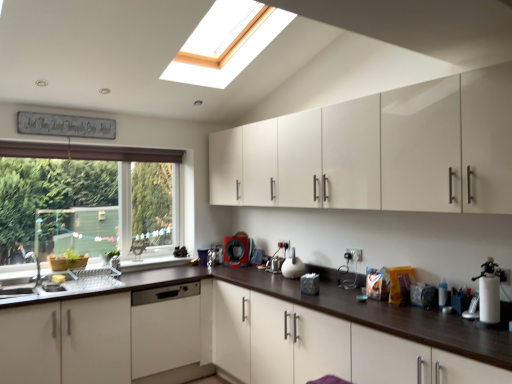
Question: Is green matte window at left wider than black plastic coffee machine at center?

Choices:
 (A) yes
 (B) no

Answer: (B)

Question: From a real-world perspective, is green matte window at left beneath black plastic coffee machine at center?

Choices:
 (A) no
 (B) yes

Answer: (A)

Question: From the image's perspective, is green matte window at left beneath black plastic coffee machine at center?

Choices:
 (A) no
 (B) yes

Answer: (A)

Question: Is green matte window at left outside of black plastic coffee machine at center?

Choices:
 (A) no
 (B) yes

Answer: (B)

Question: Considering the relative sizes of green matte window at left and black plastic coffee machine at center in the image provided, is green matte window at left bigger than black plastic coffee machine at center?

Choices:
 (A) yes
 (B) no

Answer: (A)

Question: Would you say white glossy cabinets at center, positioned as the first cabinetry in bottom-to-top order, is to the left or to the right of glossy white cabinets at upper center, placed as the 2th cabinetry when sorted from bottom to top, in the picture?

Choices:
 (A) left
 (B) right

Answer: (A)

Question: Is white glossy cabinets at center, positioned as the first cabinetry in bottom-to-top order, wider or thinner than glossy white cabinets at upper center, placed as the 2th cabinetry when sorted from bottom to top?

Choices:
 (A) wide
 (B) thin

Answer: (A)

Question: From a real-world perspective, is white glossy cabinets at center, the second cabinetry in the top-to-bottom sequence, positioned above or below glossy white cabinets at upper center, the 1th cabinetry viewed from the top?

Choices:
 (A) above
 (B) below

Answer: (B)

Question: From the image's perspective, is white glossy cabinets at center, the second cabinetry in the top-to-bottom sequence, above or below glossy white cabinets at upper center, the 1th cabinetry viewed from the top?

Choices:
 (A) above
 (B) below

Answer: (B)

Question: Would you say white glossy sink at lower left is inside or outside glossy white cabinets at upper center, placed as the 2th cabinetry when sorted from bottom to top?

Choices:
 (A) inside
 (B) outside

Answer: (B)

Question: Is white glossy sink at lower left to the left or to the right of glossy white cabinets at upper center, placed as the 2th cabinetry when sorted from bottom to top, in the image?

Choices:
 (A) right
 (B) left

Answer: (B)

Question: From a real-world perspective, relative to glossy white cabinets at upper center, placed as the 2th cabinetry when sorted from bottom to top, is white glossy sink at lower left vertically above or below?

Choices:
 (A) above
 (B) below

Answer: (B)

Question: Is point (26, 284) positioned closer to the camera than point (425, 198)?

Choices:
 (A) closer
 (B) farther

Answer: (B)

Question: Is point (229, 264) closer or farther from the camera than point (166, 155)?

Choices:
 (A) farther
 (B) closer

Answer: (B)

Question: Is black plastic coffee machine at center inside or outside of green matte window at left?

Choices:
 (A) outside
 (B) inside

Answer: (A)